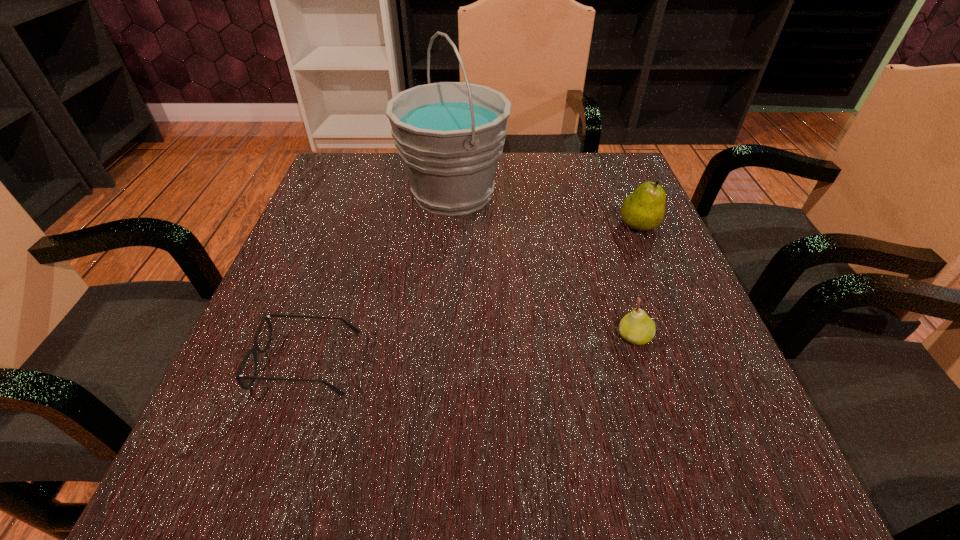
I want to click on free space between the shorter pear and the taller pear, so click(x=636, y=282).

Locate an element on the screen. This screenshot has width=960, height=540. free space between the leftmost object and the farther pear is located at coordinates (472, 294).

The height and width of the screenshot is (540, 960). Identify the location of vacant space that's between the shortest object and the bucket. (380, 278).

You are a GUI agent. You are given a task and a screenshot of the screen. Output one action in this format:
    pyautogui.click(x=<x>, y=<y>)
    Task: Click on the free spot between the spectacles and the nearer pear
    
    Given the screenshot: What is the action you would take?
    pyautogui.click(x=470, y=350)

Identify the location of free space between the third object from right to left and the leftmost object. This screenshot has height=540, width=960. (380, 278).

Where is `free space between the right pear and the leftmost object`? The height and width of the screenshot is (540, 960). free space between the right pear and the leftmost object is located at coordinates (472, 294).

You are a GUI agent. You are given a task and a screenshot of the screen. Output one action in this format:
    pyautogui.click(x=<x>, y=<y>)
    Task: Click on the vacant point located between the right pear and the bucket
    
    Given the screenshot: What is the action you would take?
    pyautogui.click(x=545, y=210)

Locate an element on the screen. The height and width of the screenshot is (540, 960). vacant space that is in between the left pear and the third object from right to left is located at coordinates (543, 265).

The height and width of the screenshot is (540, 960). Find the location of `unoccupied area between the right pear and the shorter pear`. unoccupied area between the right pear and the shorter pear is located at coordinates (636, 282).

Locate an element on the screen. The image size is (960, 540). object that can be found as the second closest to the spectacles is located at coordinates (637, 328).